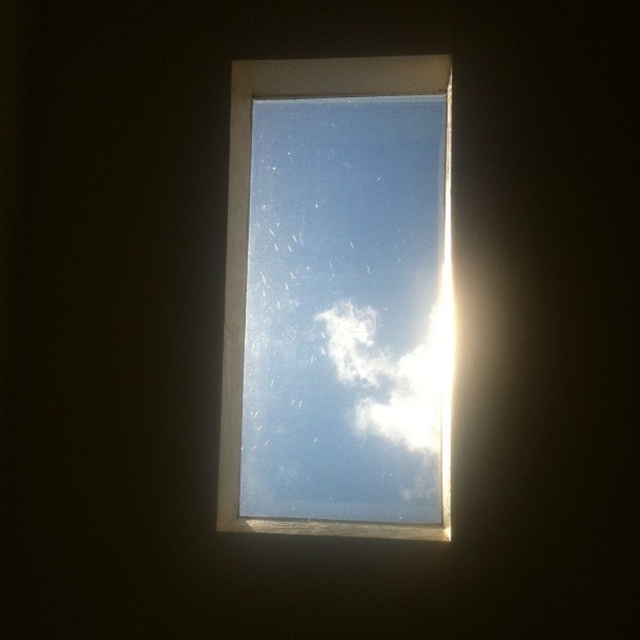
Question: Which object appears closest to the camera in this image?

Choices:
 (A) transparent glass window at upper center
 (B) white fluffy cloud at upper center

Answer: (A)

Question: Does transparent glass window at upper center come behind white fluffy cloud at upper center?

Choices:
 (A) no
 (B) yes

Answer: (A)

Question: Among these points, which one is farthest from the camera?

Choices:
 (A) (268, 97)
 (B) (353, 305)

Answer: (A)

Question: Which point appears farthest from the camera in this image?

Choices:
 (A) (236, 364)
 (B) (340, 356)

Answer: (B)

Question: Is transparent glass window at upper center above white fluffy cloud at upper center?

Choices:
 (A) yes
 (B) no

Answer: (A)

Question: Does transparent glass window at upper center appear under white fluffy cloud at upper center?

Choices:
 (A) yes
 (B) no

Answer: (B)